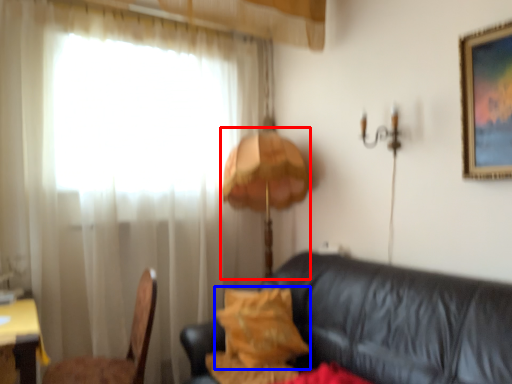
Question: Which of the following is the farthest to the observer, table lamp (highlighted by a red box) or pillow (highlighted by a blue box)?

Choices:
 (A) table lamp
 (B) pillow

Answer: (A)